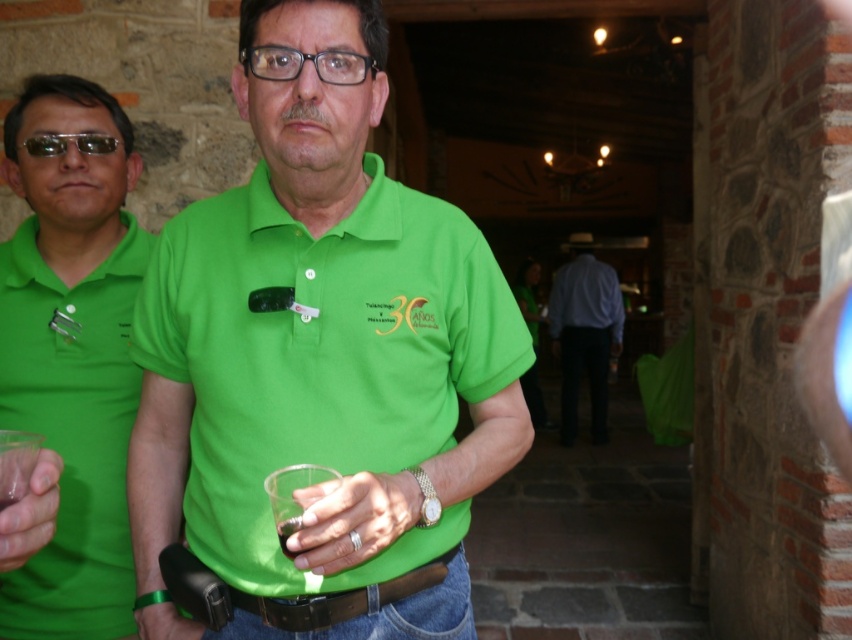
Does matte green polo shirt at left have a lesser height compared to transparent plastic cup at lower center?

No.

Is matte green polo shirt at left further to the viewer compared to transparent plastic cup at lower center?

Yes, it is behind transparent plastic cup at lower center.

You are a GUI agent. You are given a task and a screenshot of the screen. Output one action in this format:
    pyautogui.click(x=<x>, y=<y>)
    Task: Click on the matte green polo shirt at left
    The image size is (852, 640).
    Given the screenshot: What is the action you would take?
    pyautogui.click(x=72, y=355)

Identify the location of matte green polo shirt at left. The width and height of the screenshot is (852, 640). (72, 355).

Between point (119, 637) and point (594, 308), which one is positioned behind?

The point (594, 308) is more distant.

Is the position of matte green polo shirt at left more distant than that of white cotton shirt at center?

No, it is not.

Locate an element on the screen. The image size is (852, 640). matte green polo shirt at left is located at coordinates point(72,355).

Is point (81, 141) closer to camera compared to point (280, 529)?

No, (81, 141) is behind (280, 529).

Who is taller, black plastic goggles at upper left or transparent plastic cup at lower center?

transparent plastic cup at lower center is taller.

Is point (93, 134) positioned after point (281, 548)?

Yes.

You are a GUI agent. You are given a task and a screenshot of the screen. Output one action in this format:
    pyautogui.click(x=<x>, y=<y>)
    Task: Click on the black plastic goggles at upper left
    The width and height of the screenshot is (852, 640).
    Given the screenshot: What is the action you would take?
    pyautogui.click(x=67, y=141)